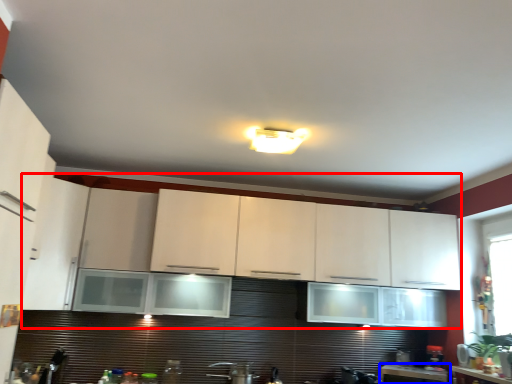
Question: Among these objects, which one is nearest to the camera, cabinetry (highlighted by a red box) or countertop (highlighted by a blue box)?

Choices:
 (A) cabinetry
 (B) countertop

Answer: (A)